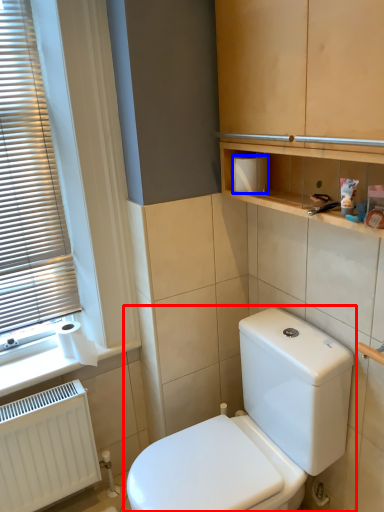
Question: Which object appears closest to the camera in this image, toilet (highlighted by a red box) or toiletry box (highlighted by a blue box)?

Choices:
 (A) toilet
 (B) toiletry box

Answer: (A)